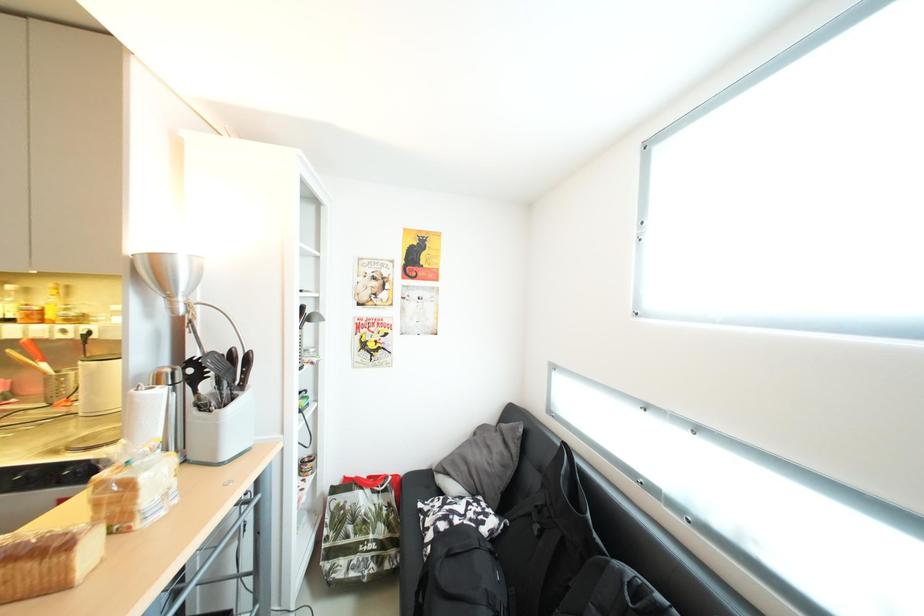
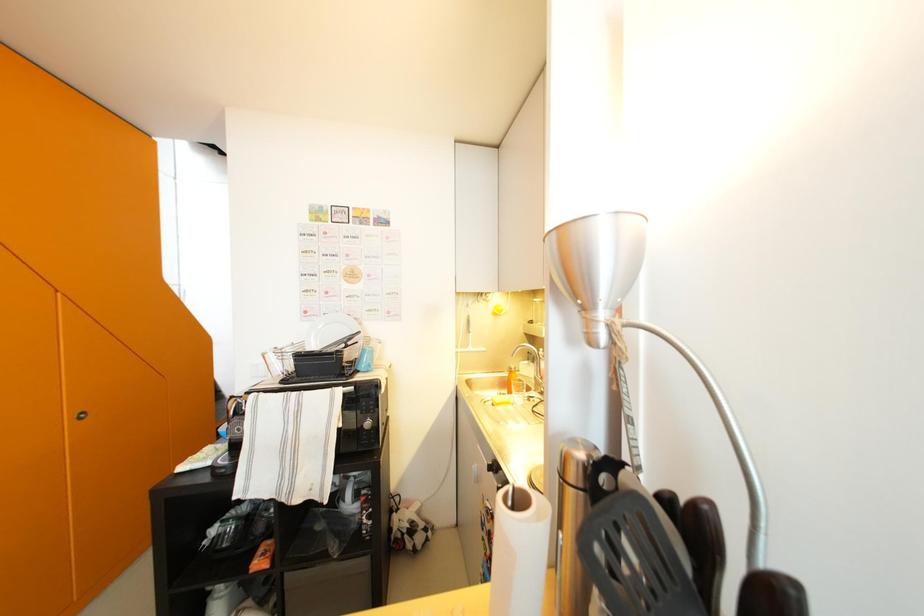
Question: The images are taken continuously from a first-person perspective. In which direction is your viewpoint rotating?

Choices:
 (A) Left
 (B) Right
 (C) Up
 (D) Down

Answer: (A)